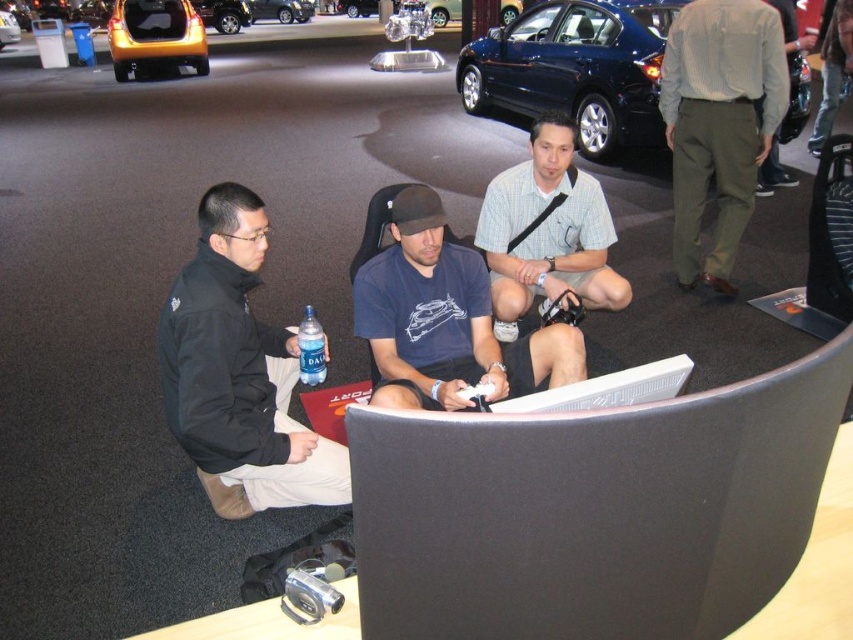
Question: Based on their relative distances, which object is nearer to the green cotton pants at upper right?

Choices:
 (A) black fabric jacket at left
 (B) gold metallic hatchback at upper left
 (C) metallic gold car at upper left
 (D) dark blue t-shirt at center

Answer: (D)

Question: Which object appears farthest from the camera in this image?

Choices:
 (A) shiny blue sedan at center
 (B) shiny metallic car at upper left
 (C) dark blue t-shirt at center
 (D) gold metallic hatchback at upper left

Answer: (B)

Question: Can you confirm if dark blue t-shirt at center is smaller than gold metallic hatchback at upper left?

Choices:
 (A) no
 (B) yes

Answer: (B)

Question: Can you confirm if green cotton pants at upper right is bigger than metallic gold car at upper left?

Choices:
 (A) yes
 (B) no

Answer: (B)

Question: Which of the following is the closest to the observer?

Choices:
 (A) green cotton pants at upper right
 (B) gold metallic hatchback at upper left
 (C) gold metallic hatchback at center
 (D) black fabric jacket at left

Answer: (D)

Question: Does black fabric jacket at left appear on the left side of gold metallic hatchback at upper left?

Choices:
 (A) no
 (B) yes

Answer: (A)